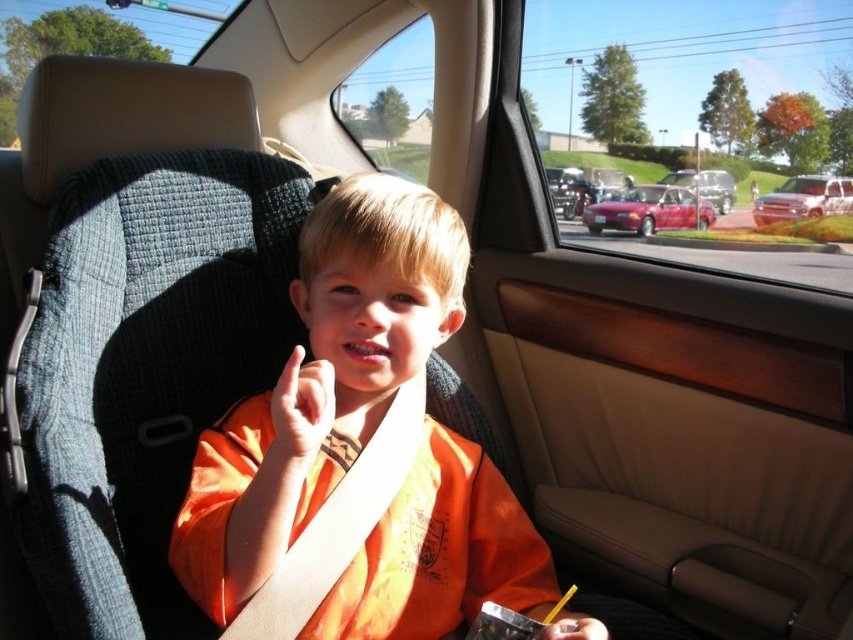
Question: Where is orange fabric shirt at center located in relation to white glossy truck at right in the image?

Choices:
 (A) right
 (B) left

Answer: (B)

Question: Among these objects, which one is farthest from the camera?

Choices:
 (A) shiny red sedan at center
 (B) white glossy truck at right

Answer: (A)

Question: Is the position of orange fabric shirt at center more distant than that of metallic silver sedan at center?

Choices:
 (A) no
 (B) yes

Answer: (A)

Question: Among these objects, which one is farthest from the camera?

Choices:
 (A) orange fabric shirt at center
 (B) shiny red sedan at center

Answer: (B)

Question: Is the position of orange fabric shirt at center less distant than that of white glossy truck at right?

Choices:
 (A) no
 (B) yes

Answer: (B)

Question: Which point appears farthest from the camera in this image?

Choices:
 (A) (778, 209)
 (B) (415, 378)
 (C) (712, 209)

Answer: (C)